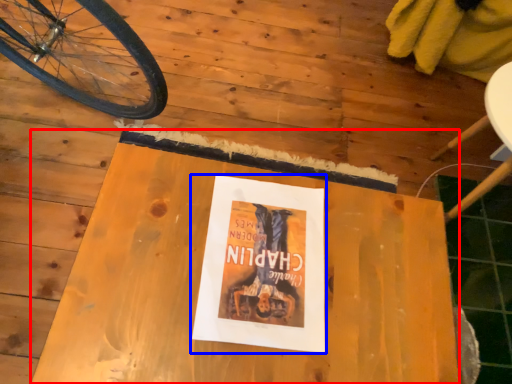
Question: Which point is closer to the camera, table (highlighted by a red box) or paperback book (highlighted by a blue box)?

Choices:
 (A) table
 (B) paperback book

Answer: (A)